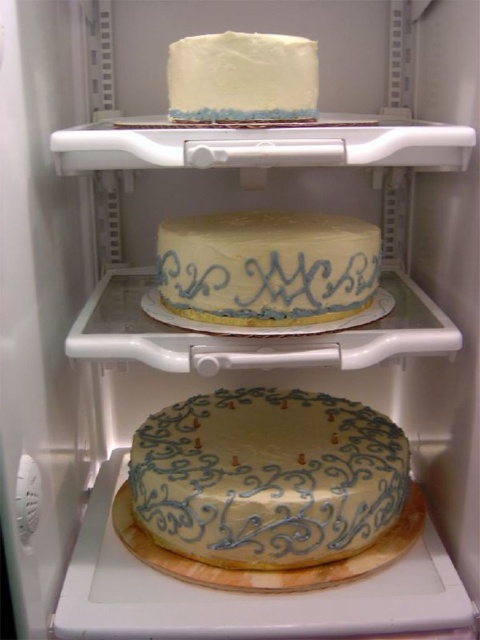
Question: Does yellow matte cake at lower center appear on the right side of white buttercream cake at center?

Choices:
 (A) yes
 (B) no

Answer: (B)

Question: Which of these objects is positioned closest to the white matte cake at upper center?

Choices:
 (A) white buttercream cake at center
 (B) yellow matte cake at lower center

Answer: (A)

Question: Which object is closer to the camera taking this photo?

Choices:
 (A) white matte cake at upper center
 (B) white buttercream cake at center

Answer: (A)

Question: Based on their relative distances, which object is farther from the white matte cake at upper center?

Choices:
 (A) yellow matte cake at lower center
 (B) white buttercream cake at center

Answer: (A)

Question: In this image, where is white buttercream cake at center located relative to white matte cake at upper center?

Choices:
 (A) right
 (B) left

Answer: (A)

Question: Can you confirm if yellow matte cake at lower center is positioned above white buttercream cake at center?

Choices:
 (A) no
 (B) yes

Answer: (A)